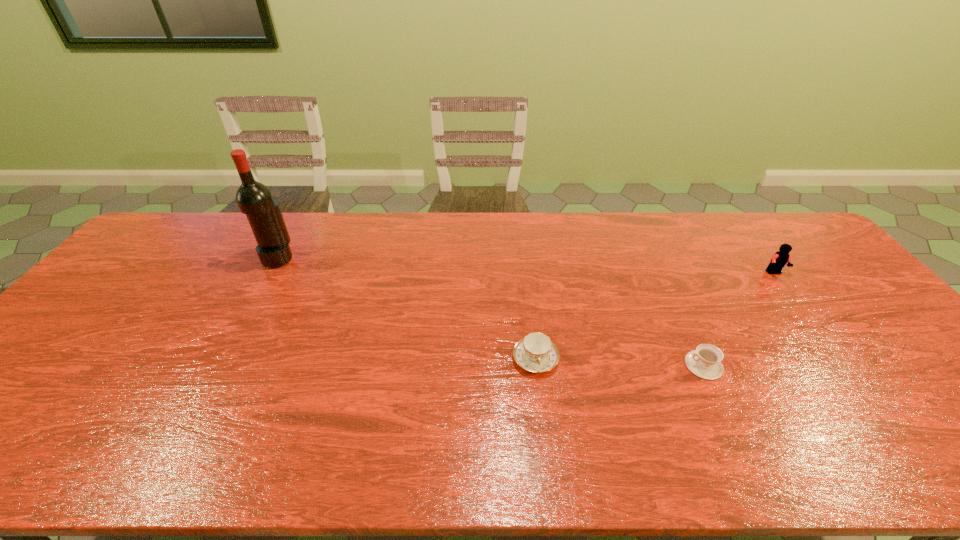
Identify the location of vacant space located on the side with the handle of the second shortest object. This screenshot has width=960, height=540. (544, 435).

Locate an element on the screen. This screenshot has height=540, width=960. free space located on the handle side of the shorter teacup is located at coordinates click(x=661, y=366).

This screenshot has width=960, height=540. In order to click on free space located 0.230m on the handle side of the shorter teacup in this screenshot , I will do `click(592, 366)`.

Locate an element on the screen. vacant space located on the handle side of the shorter teacup is located at coordinates (645, 366).

At what (x,y) coordinates should I click in order to perform the action: click on object located in the far edge section of the desktop. Please return your answer as a coordinate pair (x, y). This screenshot has height=540, width=960. Looking at the image, I should click on (254, 199).

The width and height of the screenshot is (960, 540). In order to click on free region at the far edge in this screenshot , I will do `click(304, 251)`.

This screenshot has width=960, height=540. I want to click on free space at the near edge of the desktop, so click(x=806, y=464).

Locate an element on the screen. The height and width of the screenshot is (540, 960). free space at the left edge of the desktop is located at coordinates (77, 320).

In order to click on vacant area at the far left corner of the desktop in this screenshot , I will do `click(194, 225)`.

The width and height of the screenshot is (960, 540). In the image, there is a desktop. In order to click on vacant space at the far right corner in this screenshot , I will do `click(801, 237)`.